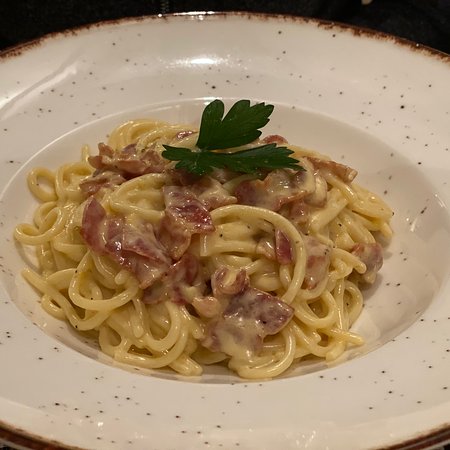
I want to click on bowl, so pos(328,137).